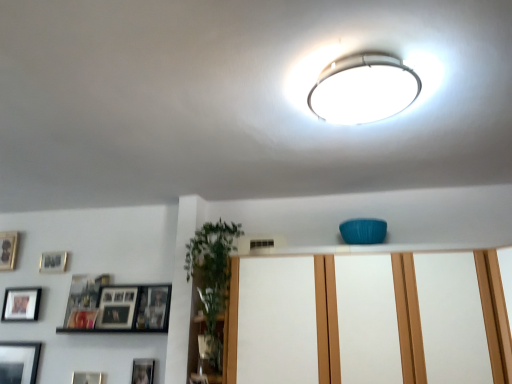
Question: From a real-world perspective, is matte black picture frame at lower left, the 5th picture frame positioned from the left, physically above white glossy ceiling light at upper center?

Choices:
 (A) yes
 (B) no

Answer: (B)

Question: Is matte black picture frame at lower left, the first picture frame from the bottom, wider than white glossy ceiling light at upper center?

Choices:
 (A) no
 (B) yes

Answer: (A)

Question: Is matte black picture frame at lower left, positioned as the 6th picture frame in top-to-bottom order, facing towards white glossy ceiling light at upper center?

Choices:
 (A) no
 (B) yes

Answer: (A)

Question: Is matte black picture frame at lower left, positioned as the 6th picture frame in top-to-bottom order, in contact with white glossy ceiling light at upper center?

Choices:
 (A) yes
 (B) no

Answer: (B)

Question: Is matte black picture frame at lower left, which appears as the 2th picture frame when viewed from the right, positioned in front of white glossy ceiling light at upper center?

Choices:
 (A) yes
 (B) no

Answer: (B)

Question: Considering the relative positions of matte black picture frame at lower left, positioned as the 6th picture frame in top-to-bottom order, and white glossy ceiling light at upper center in the image provided, is matte black picture frame at lower left, positioned as the 6th picture frame in top-to-bottom order, to the left of white glossy ceiling light at upper center from the viewer's perspective?

Choices:
 (A) no
 (B) yes

Answer: (B)

Question: Is wooden photo frame at left, the 6th picture frame ordered from the bottom, positioned behind matte black picture frame at lower left, the 5th picture frame positioned from the left?

Choices:
 (A) yes
 (B) no

Answer: (A)

Question: From the image's perspective, does wooden photo frame at left, placed as the 1th picture frame when sorted from left to right, appear higher than matte black picture frame at lower left, the 5th picture frame positioned from the left?

Choices:
 (A) no
 (B) yes

Answer: (B)

Question: From a real-world perspective, is wooden photo frame at left, placed as the 1th picture frame when sorted from left to right, physically above matte black picture frame at lower left, positioned as the 6th picture frame in top-to-bottom order?

Choices:
 (A) yes
 (B) no

Answer: (A)

Question: Can you confirm if wooden photo frame at left, which ranks as the sixth picture frame in right-to-left order, is taller than matte black picture frame at lower left, which appears as the 2th picture frame when viewed from the right?

Choices:
 (A) yes
 (B) no

Answer: (A)

Question: Would you say wooden photo frame at left, the 6th picture frame ordered from the bottom, contains matte black picture frame at lower left, positioned as the 6th picture frame in top-to-bottom order?

Choices:
 (A) yes
 (B) no

Answer: (B)

Question: Is wooden photo frame at left, placed as the 1th picture frame when sorted from left to right, far from matte black picture frame at lower left, positioned as the 6th picture frame in top-to-bottom order?

Choices:
 (A) no
 (B) yes

Answer: (A)

Question: Does matte black picture frame at upper left, which is the 3th picture frame in top-to-bottom order, appear on the left side of wooden photo frame at left, the 6th picture frame ordered from the bottom?

Choices:
 (A) no
 (B) yes

Answer: (A)